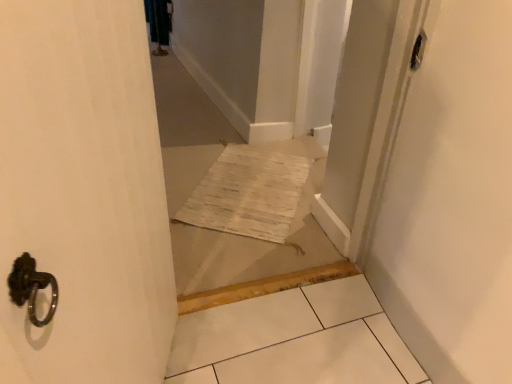
Question: Relative to transparent plastic screen door at upper right, is white woven mat at center in front or behind?

Choices:
 (A) front
 (B) behind

Answer: (A)

Question: Based on their sizes in the image, would you say white woven mat at center is bigger or smaller than transparent plastic screen door at upper right?

Choices:
 (A) small
 (B) big

Answer: (B)

Question: Would you say white woven mat at center is inside or outside transparent plastic screen door at upper right?

Choices:
 (A) outside
 (B) inside

Answer: (A)

Question: Considering the positions of point (347, 206) and point (156, 87), is point (347, 206) closer or farther from the camera than point (156, 87)?

Choices:
 (A) farther
 (B) closer

Answer: (B)

Question: From the image's perspective, is transparent plastic screen door at upper right above or below white woven mat at center?

Choices:
 (A) above
 (B) below

Answer: (B)

Question: In the image, is transparent plastic screen door at upper right positioned in front of or behind white woven mat at center?

Choices:
 (A) behind
 (B) front

Answer: (A)

Question: In terms of width, does transparent plastic screen door at upper right look wider or thinner when compared to white woven mat at center?

Choices:
 (A) wide
 (B) thin

Answer: (B)